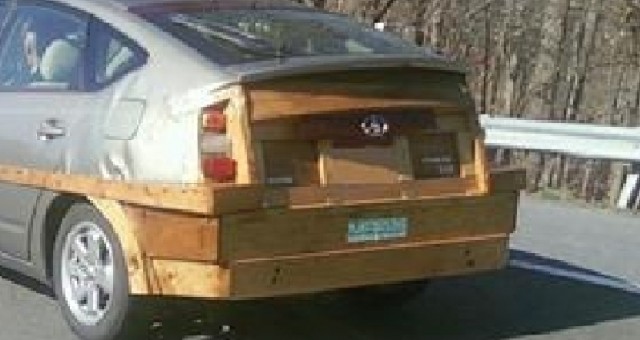
At what (x,y) coordinates should I click in order to perform the action: click on back window. Please return your answer as a coordinate pair (x, y). The image size is (640, 340). Looking at the image, I should click on (243, 51).